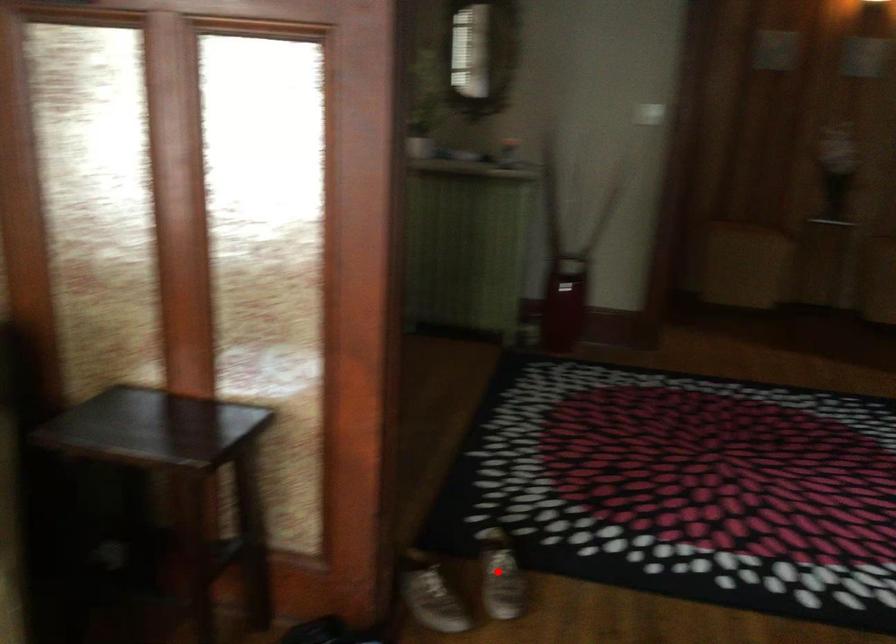
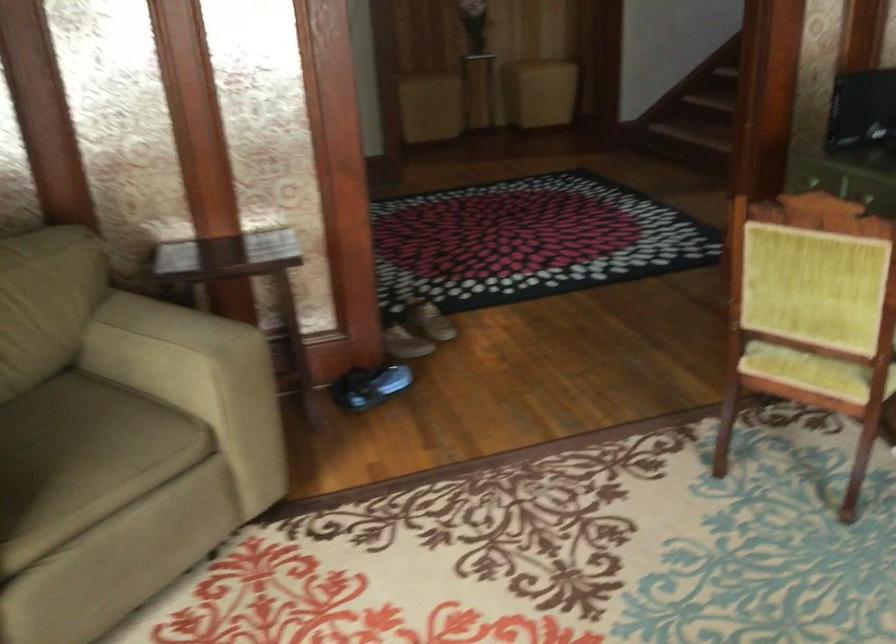
Where in the second image is the point corresponding to the highlighted location from the first image?

(431, 319)